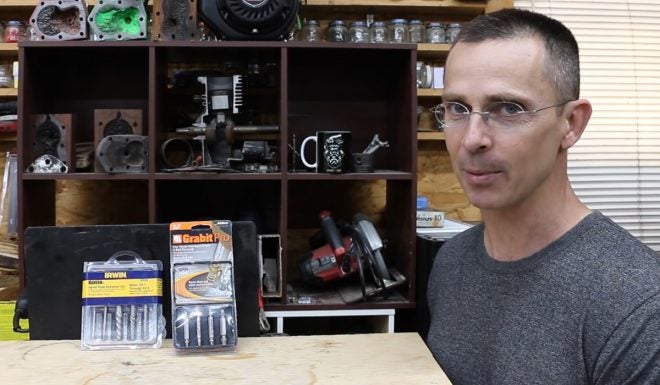
At what (x,y) coordinates should I click in order to perform the action: click on black mug. Please return your answer as a coordinate pair (x, y). The image size is (660, 385). Looking at the image, I should click on (x=339, y=158).